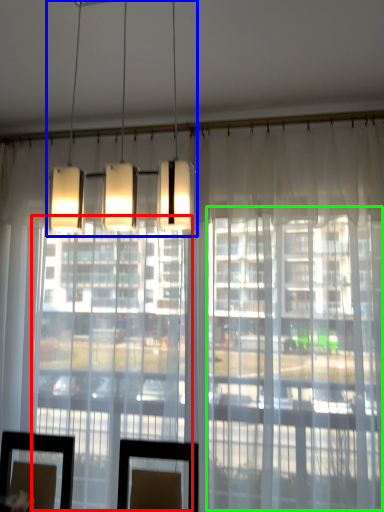
Question: Which object is positioned closest to glass door (highlighted by a red box)? Select from lamp (highlighted by a blue box) and glass door (highlighted by a green box).

Choices:
 (A) lamp
 (B) glass door

Answer: (B)